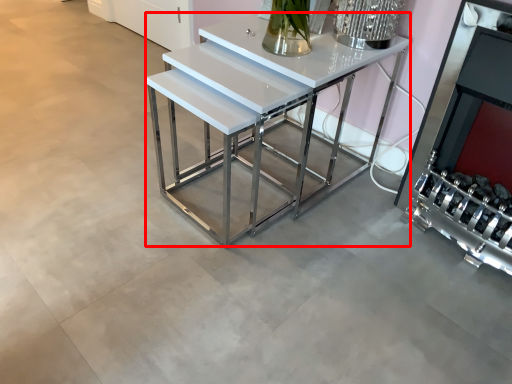
Question: Where is table (annotated by the red box) located in relation to fireplace in the image?

Choices:
 (A) right
 (B) left

Answer: (B)